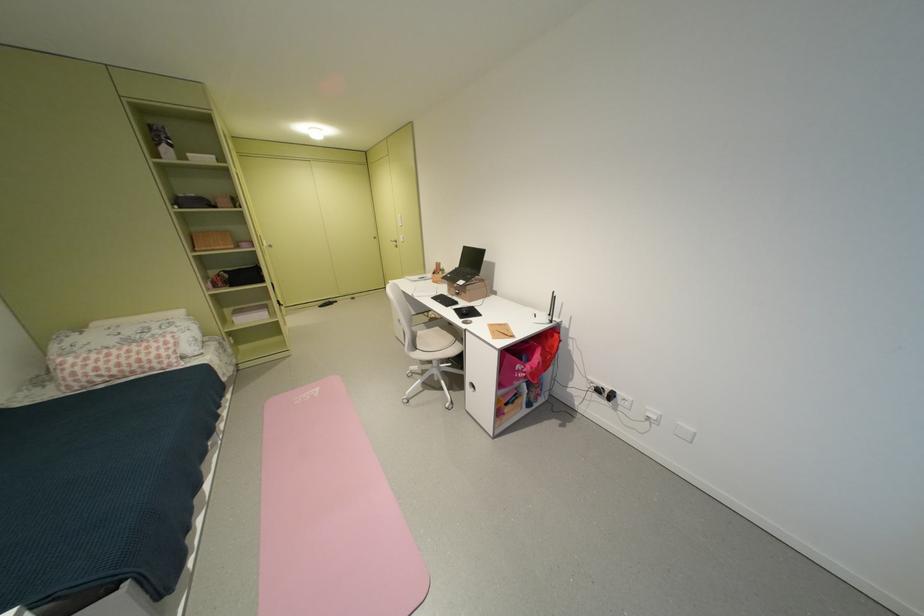
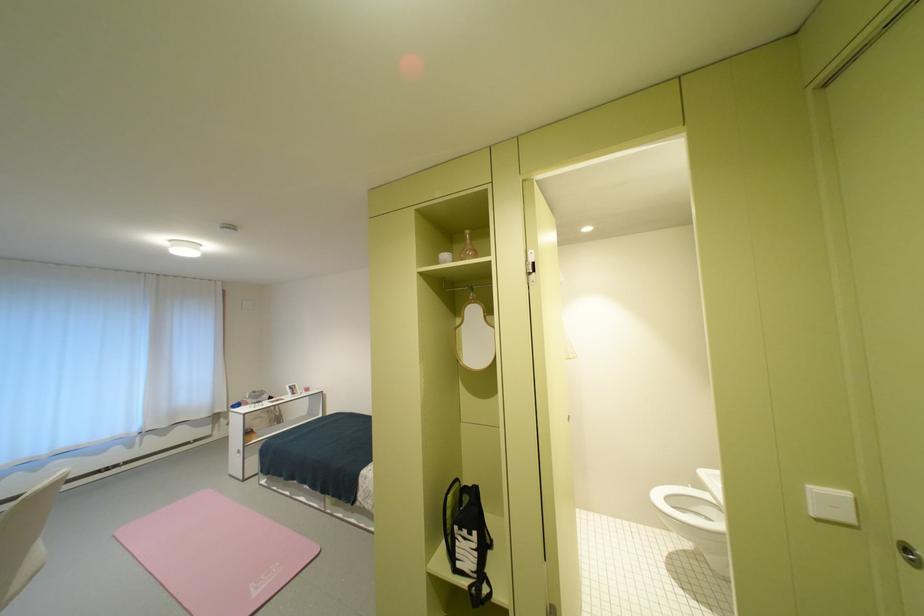
In the second image, find the point that corresponds to point 305,403 in the first image.

(286, 565)